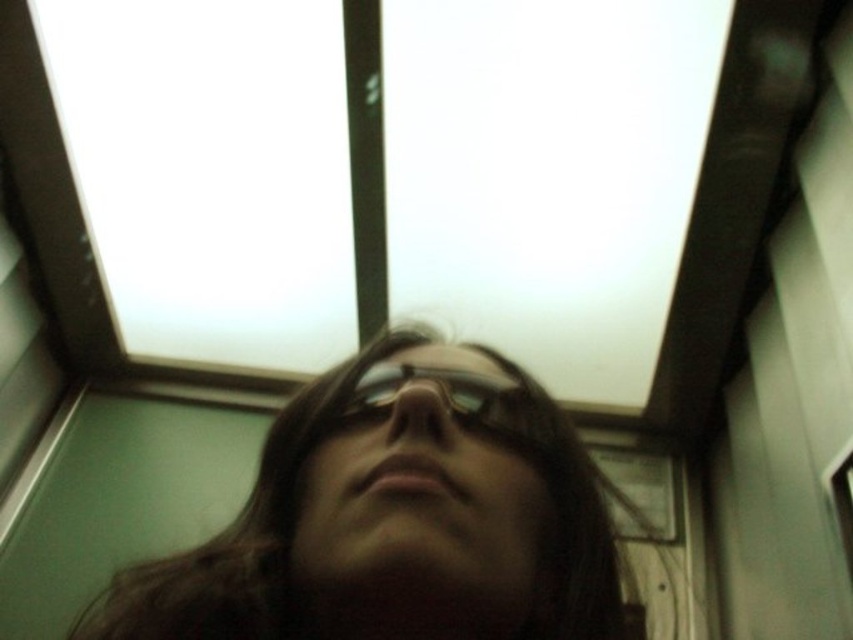
Question: Can you confirm if matte black hair at center is positioned to the left of black reflective glasses at center?

Choices:
 (A) yes
 (B) no

Answer: (B)

Question: Does matte black hair at center have a lesser width compared to black reflective glasses at center?

Choices:
 (A) yes
 (B) no

Answer: (B)

Question: Does matte black hair at center lie in front of black reflective glasses at center?

Choices:
 (A) no
 (B) yes

Answer: (B)